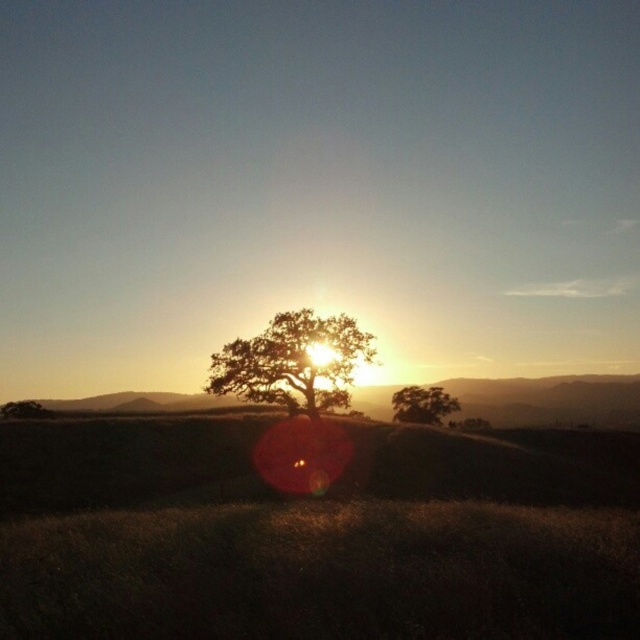
Does silvery textured tree at center have a larger size compared to green matte tree at center?

No, silvery textured tree at center is not bigger than green matte tree at center.

Does point (314, 388) lie in front of point (422, 412)?

Yes, point (314, 388) is in front of point (422, 412).

Which is behind, point (296, 364) or point (403, 406)?

The point (403, 406) is more distant.

At what (x,y) coordinates should I click in order to perform the action: click on silvery textured tree at center. Please return your answer as a coordinate pair (x, y). This screenshot has height=640, width=640. Looking at the image, I should click on (292, 362).

Which of these two, green matte tree at center or brown matte tree at lower left, stands shorter?

green matte tree at center

Who is positioned more to the right, green matte tree at center or brown matte tree at lower left?

green matte tree at center

Is point (460, 408) positioned after point (10, 404)?

That is True.

You are a GUI agent. You are given a task and a screenshot of the screen. Output one action in this format:
    pyautogui.click(x=<x>, y=<y>)
    Task: Click on the green matte tree at center
    
    Given the screenshot: What is the action you would take?
    (x=422, y=404)

Can you confirm if silvery textured tree at center is positioned to the right of brown matte tree at lower left?

Yes, silvery textured tree at center is to the right of brown matte tree at lower left.

Does silvery textured tree at center lie behind brown matte tree at lower left?

That is False.

Does point (337, 369) come in front of point (12, 412)?

Yes.

Locate an element on the screen. silvery textured tree at center is located at coordinates (292, 362).